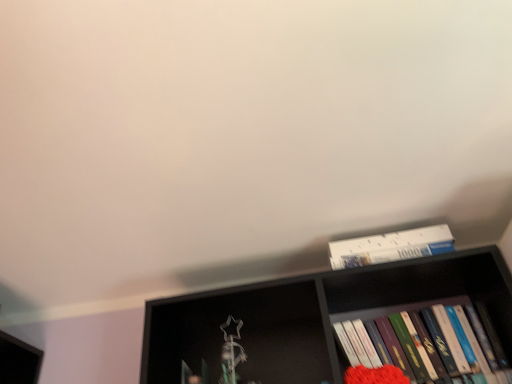
The width and height of the screenshot is (512, 384). Describe the element at coordinates (339, 325) in the screenshot. I see `black matte bookshelf at upper center` at that location.

Identify the location of white paperboard puzzle at upper right, placed as the first book when sorted from top to bottom. This screenshot has width=512, height=384. (391, 247).

How different are the orientations of black matte bookshelf at upper center and hardcover books at right, the second book from the top, in degrees?

0.249 degrees.

Relative to hardcover books at right, the second book from the top, is black matte bookshelf at upper center in front or behind?

In the image, black matte bookshelf at upper center appears in front of hardcover books at right, the second book from the top.

Is black matte bookshelf at upper center bigger or smaller than hardcover books at right, the first book positioned from the bottom?

Clearly, black matte bookshelf at upper center is larger in size than hardcover books at right, the first book positioned from the bottom.

You are a GUI agent. You are given a task and a screenshot of the screen. Output one action in this format:
    pyautogui.click(x=<x>, y=<y>)
    Task: Click on the 2nd book to the right of the black matte bookshelf at upper center, counting from the anchor's position
    The width and height of the screenshot is (512, 384).
    Given the screenshot: What is the action you would take?
    pyautogui.click(x=426, y=342)

Between white paperboard puzzle at upper right, the 2th book from the bottom, and black matte bookshelf at upper center, which one has smaller size?

Smaller between the two is white paperboard puzzle at upper right, the 2th book from the bottom.

Is point (362, 257) positioned after point (170, 342)?

No, (362, 257) is closer to viewer.

From a real-world perspective, is white paperboard puzzle at upper right, the 2th book from the bottom, on black matte bookshelf at upper center?

Correct, in the physical world, white paperboard puzzle at upper right, the 2th book from the bottom, is higher than black matte bookshelf at upper center.

Can you confirm if white paperboard puzzle at upper right, the 2th book from the bottom, is thinner than black matte bookshelf at upper center?

Yes.

Which point is more forward, (399, 354) or (426, 232)?

The point (399, 354) is more forward.

From the image's perspective, is black matte bookshelf at upper center above or below white paperboard puzzle at upper right, placed as the first book when sorted from top to bottom?

Clearly, from the image's perspective, black matte bookshelf at upper center is below white paperboard puzzle at upper right, placed as the first book when sorted from top to bottom.

How distant is black matte bookshelf at upper center from white paperboard puzzle at upper right, placed as the first book when sorted from top to bottom?

black matte bookshelf at upper center and white paperboard puzzle at upper right, placed as the first book when sorted from top to bottom, are 9.22 inches apart.

Is black matte bookshelf at upper center smaller than white paperboard puzzle at upper right, the 2th book from the bottom?

No, black matte bookshelf at upper center is not smaller than white paperboard puzzle at upper right, the 2th book from the bottom.

Between white paperboard puzzle at upper right, the 2th book from the bottom, and hardcover books at right, the first book positioned from the bottom, which one appears on the left side from the viewer's perspective?

From the viewer's perspective, white paperboard puzzle at upper right, the 2th book from the bottom, appears more on the left side.

There is a hardcover books at right, the first book positioned from the bottom. Find the location of `book above it (from a real-world perspective)`. book above it (from a real-world perspective) is located at coordinates (391, 247).

From a real-world perspective, is white paperboard puzzle at upper right, the 2th book from the bottom, physically above hardcover books at right, the first book positioned from the bottom?

Yes, from a real-world perspective, white paperboard puzzle at upper right, the 2th book from the bottom, is on top of hardcover books at right, the first book positioned from the bottom.

Can you tell me how much white paperboard puzzle at upper right, placed as the first book when sorted from top to bottom, and hardcover books at right, the second book from the top, differ in facing direction?

0.0181 degrees.

Does hardcover books at right, the second book from the top, come behind white paperboard puzzle at upper right, the 2th book from the bottom?

No, hardcover books at right, the second book from the top, is closer to the viewer.

Is hardcover books at right, the first book positioned from the bottom, oriented away from white paperboard puzzle at upper right, the 2th book from the bottom?

No, hardcover books at right, the first book positioned from the bottom,'s orientation is not away from white paperboard puzzle at upper right, the 2th book from the bottom.

Can you tell me how much hardcover books at right, the first book positioned from the bottom, and white paperboard puzzle at upper right, the 2th book from the bottom, differ in facing direction?

0.0181 degrees.

Is hardcover books at right, the first book positioned from the bottom, at the right side of black matte bookshelf at upper center?

Answer: Correct, you'll find hardcover books at right, the first book positioned from the bottom, to the right of black matte bookshelf at upper center.

How different are the orientations of hardcover books at right, the first book positioned from the bottom, and black matte bookshelf at upper center in degrees?

0.249 degrees.

Which object is wider, hardcover books at right, the first book positioned from the bottom, or black matte bookshelf at upper center?

black matte bookshelf at upper center.

Is point (481, 333) closer or farther from the camera than point (453, 306)?

Point (481, 333) is closer to the camera than point (453, 306).

Find the location of a particular element. The height and width of the screenshot is (384, 512). book below the black matte bookshelf at upper center (from the image's perspective) is located at coordinates (426, 342).

I want to click on shelf that is on the left side of white paperboard puzzle at upper right, the 2th book from the bottom, so click(x=339, y=325).

Which object lies nearer to the anchor point black matte bookshelf at upper center, hardcover books at right, the second book from the top, or white paperboard puzzle at upper right, the 2th book from the bottom?

hardcover books at right, the second book from the top, lies closer to black matte bookshelf at upper center than the other object.

Looking at the image, which one is located further to white paperboard puzzle at upper right, the 2th book from the bottom, hardcover books at right, the second book from the top, or black matte bookshelf at upper center?

hardcover books at right, the second book from the top, is further to white paperboard puzzle at upper right, the 2th book from the bottom.

Considering their positions, is black matte bookshelf at upper center positioned further to white paperboard puzzle at upper right, the 2th book from the bottom, than hardcover books at right, the first book positioned from the bottom?

hardcover books at right, the first book positioned from the bottom.

Estimate the real-world distances between objects in this image. Which object is closer to hardcover books at right, the second book from the top, white paperboard puzzle at upper right, the 2th book from the bottom, or black matte bookshelf at upper center?

The object closer to hardcover books at right, the second book from the top, is black matte bookshelf at upper center.

Estimate the real-world distances between objects in this image. Which object is closer to black matte bookshelf at upper center, white paperboard puzzle at upper right, the 2th book from the bottom, or hardcover books at right, the first book positioned from the bottom?

The object closer to black matte bookshelf at upper center is hardcover books at right, the first book positioned from the bottom.

From the image, which object appears to be nearer to hardcover books at right, the second book from the top, black matte bookshelf at upper center or white paperboard puzzle at upper right, placed as the first book when sorted from top to bottom?

black matte bookshelf at upper center is closer to hardcover books at right, the second book from the top.

The image size is (512, 384). I want to click on shelf between white paperboard puzzle at upper right, placed as the first book when sorted from top to bottom, and hardcover books at right, the second book from the top, from top to bottom, so click(x=339, y=325).